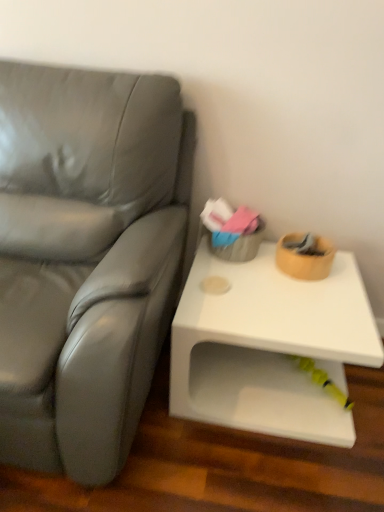
Question: Is white glossy table at right in contact with matte gray couch at left?

Choices:
 (A) yes
 (B) no

Answer: (B)

Question: Is matte gray couch at left inside white glossy table at right?

Choices:
 (A) no
 (B) yes

Answer: (A)

Question: Does white glossy table at right come in front of matte gray couch at left?

Choices:
 (A) yes
 (B) no

Answer: (B)

Question: Does white glossy table at right have a greater height compared to matte gray couch at left?

Choices:
 (A) yes
 (B) no

Answer: (B)

Question: Does white glossy table at right have a lesser height compared to matte gray couch at left?

Choices:
 (A) yes
 (B) no

Answer: (A)

Question: Does white glossy table at right lie behind matte gray couch at left?

Choices:
 (A) no
 (B) yes

Answer: (B)

Question: Is white glossy table at right surrounded by matte gray couch at left?

Choices:
 (A) yes
 (B) no

Answer: (B)

Question: Can you confirm if matte gray couch at left is smaller than white glossy table at right?

Choices:
 (A) no
 (B) yes

Answer: (A)

Question: Is matte gray couch at left next to white glossy table at right and touching it?

Choices:
 (A) yes
 (B) no

Answer: (B)

Question: Is matte gray couch at left taller than white glossy table at right?

Choices:
 (A) yes
 (B) no

Answer: (A)

Question: From a real-world perspective, is matte gray couch at left located beneath white glossy table at right?

Choices:
 (A) no
 (B) yes

Answer: (A)

Question: Is matte gray couch at left positioned beyond the bounds of white glossy table at right?

Choices:
 (A) no
 (B) yes

Answer: (B)

Question: Relative to matte gray couch at left, is white glossy table at right in front or behind?

Choices:
 (A) behind
 (B) front

Answer: (A)